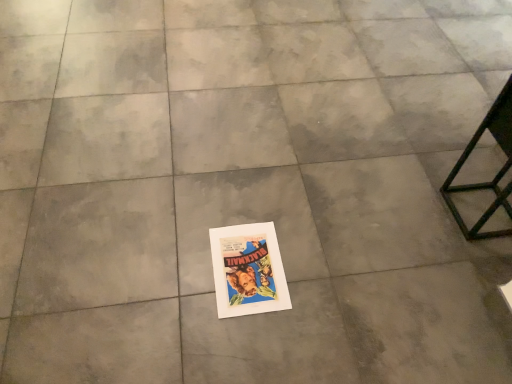
This screenshot has height=384, width=512. In order to click on vibrant paper poster at center in this screenshot , I will do `click(248, 270)`.

The height and width of the screenshot is (384, 512). What do you see at coordinates (248, 270) in the screenshot?
I see `vibrant paper poster at center` at bounding box center [248, 270].

The image size is (512, 384). What are the coordinates of `metallic black table at right` in the screenshot? It's located at (495, 175).

Describe the element at coordinates (495, 175) in the screenshot. I see `metallic black table at right` at that location.

Measure the distance between point (463, 221) and camera.

The distance of point (463, 221) from camera is 4.70 feet.

Locate an element on the screen. The image size is (512, 384). vibrant paper poster at center is located at coordinates [x=248, y=270].

Is vibrant paper poster at center at the left side of metallic black table at right?

Yes, vibrant paper poster at center is to the left of metallic black table at right.

Is the position of vibrant paper poster at center more distant than that of metallic black table at right?

That is True.

Does point (258, 303) appear closer or farther from the camera than point (476, 140)?

Point (258, 303) is positioned closer to the camera compared to point (476, 140).

From the image's perspective, which one is positioned higher, vibrant paper poster at center or metallic black table at right?

metallic black table at right appears higher in the image.

From a real-world perspective, is vibrant paper poster at center positioned above or below metallic black table at right?

In terms of real-world spatial position, vibrant paper poster at center is below metallic black table at right.

Which of these two, vibrant paper poster at center or metallic black table at right, is thinner?

metallic black table at right is thinner.

Which of these two, vibrant paper poster at center or metallic black table at right, stands taller?

With more height is metallic black table at right.

Between vibrant paper poster at center and metallic black table at right, which one has larger size?

With larger size is metallic black table at right.

Do you think vibrant paper poster at center is within metallic black table at right, or outside of it?

vibrant paper poster at center is not inside metallic black table at right, it's outside.

Is vibrant paper poster at center positioned far away from metallic black table at right?

Actually, vibrant paper poster at center and metallic black table at right are a little close together.

Is vibrant paper poster at center oriented away from metallic black table at right?

No.

How many degrees apart are the facing directions of vibrant paper poster at center and metallic black table at right?

89.5 degrees separate the facing orientations of vibrant paper poster at center and metallic black table at right.

The height and width of the screenshot is (384, 512). What are the coordinates of `poster behind the metallic black table at right` in the screenshot? It's located at (248, 270).

Considering the relative positions of metallic black table at right and vibrant paper poster at center in the image provided, is metallic black table at right to the right of vibrant paper poster at center from the viewer's perspective?

Correct, you'll find metallic black table at right to the right of vibrant paper poster at center.

Considering their positions, is metallic black table at right located in front of or behind vibrant paper poster at center?

metallic black table at right is positioned closer to the viewer than vibrant paper poster at center.

Does point (484, 182) lie in front of point (267, 239)?

No, (484, 182) is behind (267, 239).

From the image's perspective, which one is positioned lower, metallic black table at right or vibrant paper poster at center?

vibrant paper poster at center, from the image's perspective.

From a real-world perspective, is metallic black table at right positioned above or below vibrant paper poster at center?

Clearly, from a real-world perspective, metallic black table at right is above vibrant paper poster at center.

Considering the relative sizes of metallic black table at right and vibrant paper poster at center in the image provided, is metallic black table at right wider than vibrant paper poster at center?

Incorrect, the width of metallic black table at right does not surpass that of vibrant paper poster at center.

Is metallic black table at right taller than vibrant paper poster at center?

Yes, metallic black table at right is taller than vibrant paper poster at center.

Who is bigger, metallic black table at right or vibrant paper poster at center?

metallic black table at right is bigger.

Is metallic black table at right inside or outside of vibrant paper poster at center?

metallic black table at right is not inside vibrant paper poster at center, it's outside.

Would you say metallic black table at right is a long distance from vibrant paper poster at center?

No, metallic black table at right is not far from vibrant paper poster at center.

Is metallic black table at right turned away from vibrant paper poster at center?

No, metallic black table at right is not facing the opposite direction of vibrant paper poster at center.

At what (x,y) coordinates should I click in order to perform the action: click on furniture above the vibrant paper poster at center (from the image's perspective). Please return your answer as a coordinate pair (x, y). Image resolution: width=512 pixels, height=384 pixels. Looking at the image, I should click on (495, 175).

The image size is (512, 384). Identify the location of furniture above the vibrant paper poster at center (from the image's perspective). (495, 175).

The width and height of the screenshot is (512, 384). Find the location of `furniture on the right of vibrant paper poster at center`. furniture on the right of vibrant paper poster at center is located at coordinates click(495, 175).